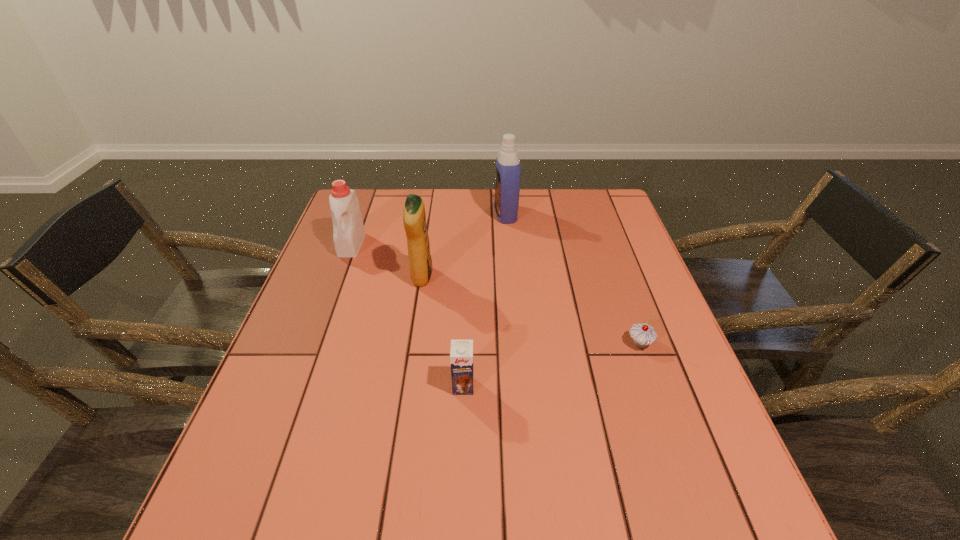
You are a GUI agent. You are given a task and a screenshot of the screen. Output one action in this format:
    pyautogui.click(x=<x>, y=<y>)
    Task: Click on the free space between the second shortest object and the fourth nearest object
    The height and width of the screenshot is (540, 960).
    Given the screenshot: What is the action you would take?
    pyautogui.click(x=407, y=315)

The height and width of the screenshot is (540, 960). I want to click on free space that is in between the second detergent from right to left and the farthest detergent, so click(464, 246).

Identify the location of free spot between the fourth tallest object and the fourth object from left to right. The width and height of the screenshot is (960, 540). (485, 300).

This screenshot has width=960, height=540. I want to click on the closest object to the third tallest object, so click(x=414, y=217).

I want to click on object identified as the fourth closest to the rightmost detergent, so click(461, 354).

Locate which detergent ranks second in proximity to the third object from left to right. Please provide its 2D coordinates. Your answer should be formatted as a tuple, i.e. [(x, y)], where the tuple contains the x and y coordinates of a point satisfying the conditions above.

[(348, 230)]

The height and width of the screenshot is (540, 960). Find the location of `detergent that is the closest to the second detergent from right to left`. detergent that is the closest to the second detergent from right to left is located at coordinates click(x=348, y=230).

I want to click on vacant space that satisfies the following two spatial constraints: 1. on the handle side of the cupcake; 2. on the right side of the leftmost detergent, so point(315,343).

Identify the location of free space that satisfies the following two spatial constraints: 1. on the front side of the second object from right to left; 2. on the left side of the rightmost object. The height and width of the screenshot is (540, 960). pyautogui.click(x=516, y=343).

What are the coordinates of `free space in the image that satisfies the following two spatial constraints: 1. on the label of the third farthest object; 2. on the left side of the cupcake` in the screenshot? It's located at (412, 343).